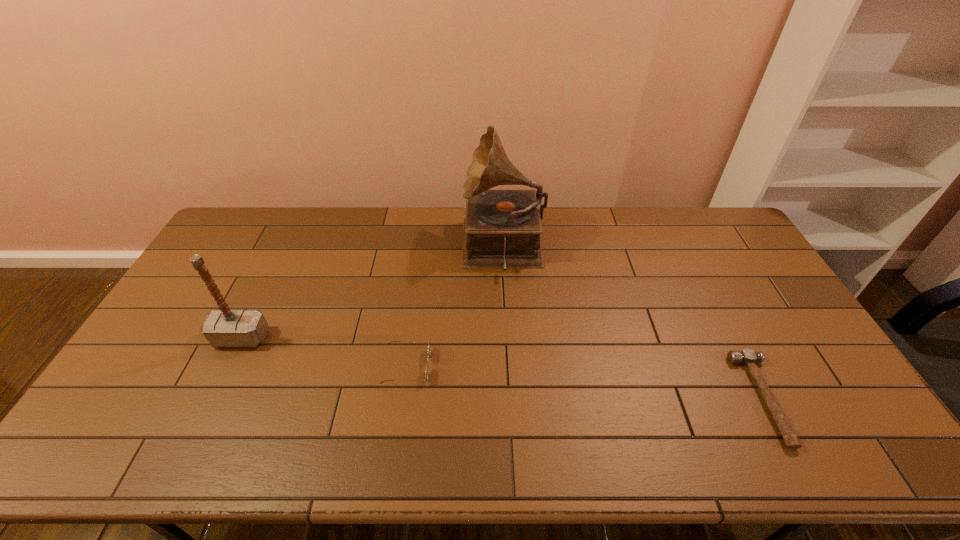
The width and height of the screenshot is (960, 540). In order to click on blank area located from the horn of the record player in this screenshot , I will do `click(404, 248)`.

You are a GUI agent. You are given a task and a screenshot of the screen. Output one action in this format:
    pyautogui.click(x=<x>, y=<y>)
    Task: Click on the free space located on the striking surface of the farther hammer
    Image resolution: width=960 pixels, height=540 pixels.
    Given the screenshot: What is the action you would take?
    pyautogui.click(x=222, y=377)

You are a GUI agent. You are given a task and a screenshot of the screen. Output one action in this format:
    pyautogui.click(x=<x>, y=<y>)
    Task: Click on the free spot located 0.240m on the front-facing side of the second object from left to right
    
    Given the screenshot: What is the action you would take?
    pyautogui.click(x=516, y=366)

The width and height of the screenshot is (960, 540). I want to click on vacant space located on the striking face of the shorter hammer, so click(x=688, y=399).

The height and width of the screenshot is (540, 960). I want to click on vacant area situated 0.230m on the striking face of the shorter hammer, so click(x=658, y=399).

The image size is (960, 540). In order to click on vacant space located on the striking face of the shorter hammer in this screenshot , I will do click(614, 399).

Where is `object that is positioned at the far edge`? This screenshot has height=540, width=960. object that is positioned at the far edge is located at coordinates (502, 228).

You are a GUI agent. You are given a task and a screenshot of the screen. Output one action in this format:
    pyautogui.click(x=<x>, y=<y>)
    Task: Click on the object at the near edge
    This screenshot has height=540, width=960.
    Given the screenshot: What is the action you would take?
    pyautogui.click(x=748, y=357)

In the image, there is a desktop. At what (x,y) coordinates should I click in order to perform the action: click on vacant area at the far edge. Please return your answer as a coordinate pair (x, y). The image size is (960, 540). Looking at the image, I should click on (441, 226).

Locate an element on the screen. Image resolution: width=960 pixels, height=540 pixels. free region at the near edge of the desktop is located at coordinates (192, 457).